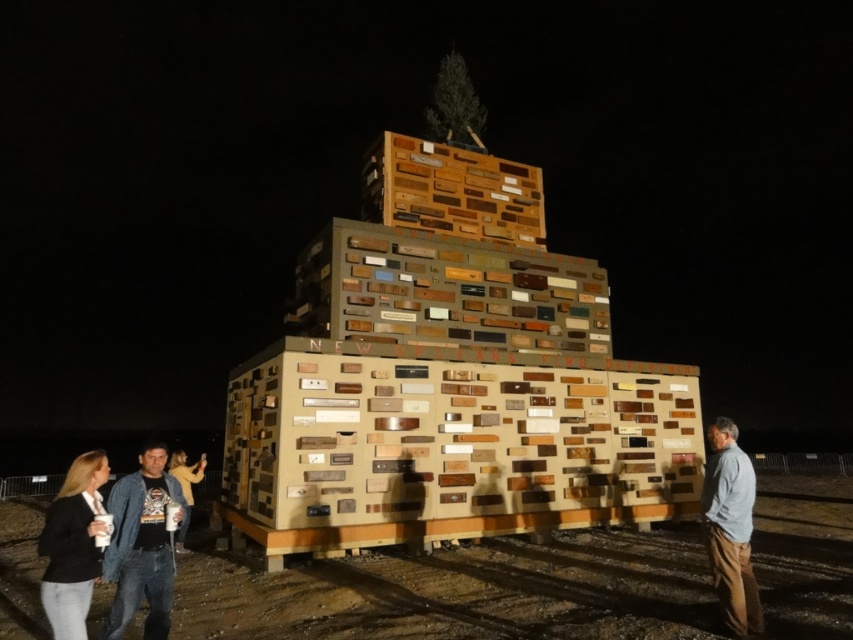
Question: Which point is closer to the camera?

Choices:
 (A) (134, 496)
 (B) (735, 620)

Answer: (A)

Question: Which point is closer to the camera?

Choices:
 (A) gray cotton shirt at lower right
 (B) denim jacket at lower left

Answer: (B)

Question: Which of the following is the farthest from the observer?

Choices:
 (A) (115, 628)
 (B) (753, 608)

Answer: (B)

Question: Observing the image, what is the correct spatial positioning of denim jacket at lower left in reference to gray cotton shirt at lower right?

Choices:
 (A) above
 (B) below

Answer: (A)

Question: Considering the relative positions of denim jacket at lower left and gray cotton shirt at lower right in the image provided, where is denim jacket at lower left located with respect to gray cotton shirt at lower right?

Choices:
 (A) above
 (B) below

Answer: (A)

Question: Does denim jacket at lower left have a smaller size compared to gray cotton shirt at lower right?

Choices:
 (A) yes
 (B) no

Answer: (A)